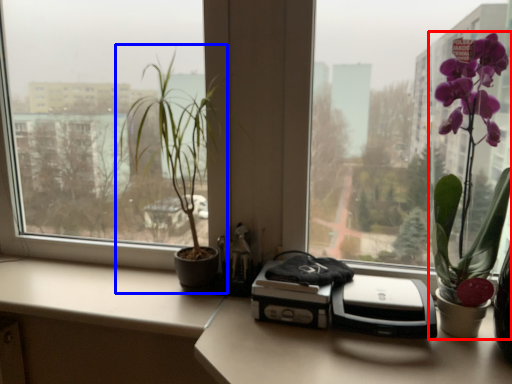
Question: Among these objects, which one is farthest to the camera, houseplant (highlighted by a red box) or houseplant (highlighted by a blue box)?

Choices:
 (A) houseplant
 (B) houseplant

Answer: (B)